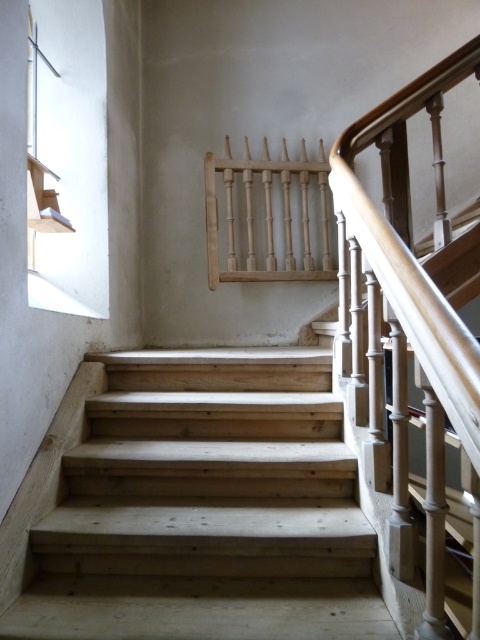
You are standing at the entrance of the building and want to reach the first floor. The natural wood stairs at center are your only option. Based on their position, can you estimate where exactly the stairs are located in the image?

The natural wood stairs at center are located at point 0.795 on the x axis and 0.429 on the y axis in the image.

You are standing at point [205,508]. What object is directly beneath you?

The natural wood stairs at center are directly beneath you at point [205,508].